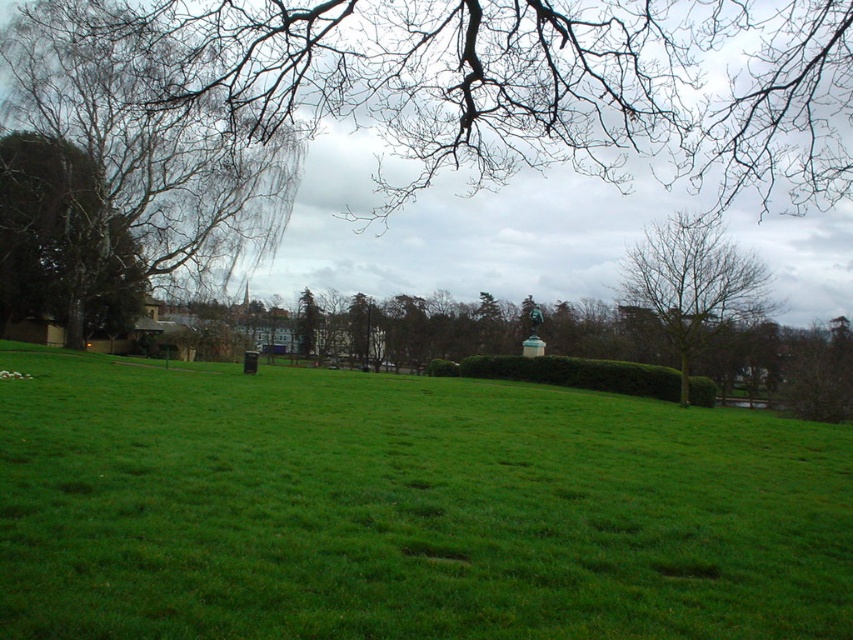
Question: Does bare branches at left have a lesser width compared to green leafy hedge at center?

Choices:
 (A) yes
 (B) no

Answer: (B)

Question: Which of these objects is positioned farthest from the green grassy at center?

Choices:
 (A) green leafy hedge at center
 (B) bare branches at left

Answer: (A)

Question: Does bare branches at left appear on the left side of green leafy tree at left?

Choices:
 (A) yes
 (B) no

Answer: (B)

Question: Which point is farther from the camera taking this photo?

Choices:
 (A) (169, 115)
 (B) (746, 19)
 (C) (122, 266)
 (D) (434, 637)

Answer: (C)

Question: Estimate the real-world distances between objects in this image. Which object is closer to the bare branches at left?

Choices:
 (A) green leafy tree at left
 (B) bare branches at upper right
 (C) green grassy at center
 (D) green leafy hedge at center

Answer: (A)

Question: Does green leafy tree at left appear on the left side of green leafy hedge at center?

Choices:
 (A) no
 (B) yes

Answer: (B)